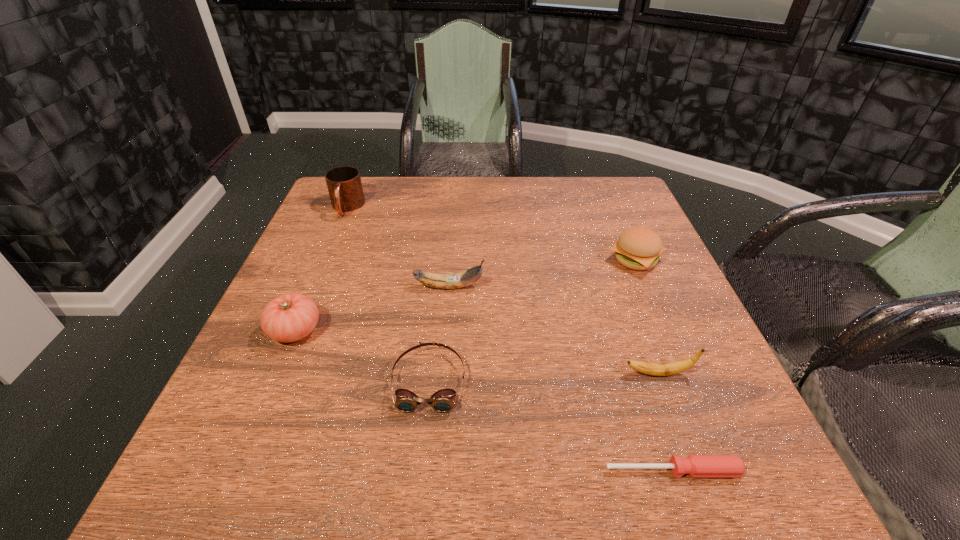
At what (x,y) coordinates should I click in order to perform the action: click on the farthest object. Please return your answer as a coordinate pair (x, y). This screenshot has height=540, width=960. Looking at the image, I should click on (344, 184).

Locate an element on the screen. The width and height of the screenshot is (960, 540). the taller banana is located at coordinates (462, 279).

At what (x,y) coordinates should I click in order to perform the action: click on the fifth nearest object. Please return your answer as a coordinate pair (x, y). Looking at the image, I should click on (462, 279).

At what (x,y) coordinates should I click in order to perform the action: click on the sixth nearest object. Please return your answer as a coordinate pair (x, y). Looking at the image, I should click on (638, 248).

This screenshot has width=960, height=540. I want to click on tomato, so click(289, 317).

The width and height of the screenshot is (960, 540). I want to click on the right banana, so click(x=671, y=368).

I want to click on the shorter banana, so [x=671, y=368].

Identify the location of goggles. This screenshot has height=540, width=960. (443, 400).

This screenshot has height=540, width=960. What are the coordinates of `the shortest object` in the screenshot? It's located at (695, 465).

Identify the location of the nearest object. The width and height of the screenshot is (960, 540). (695, 465).